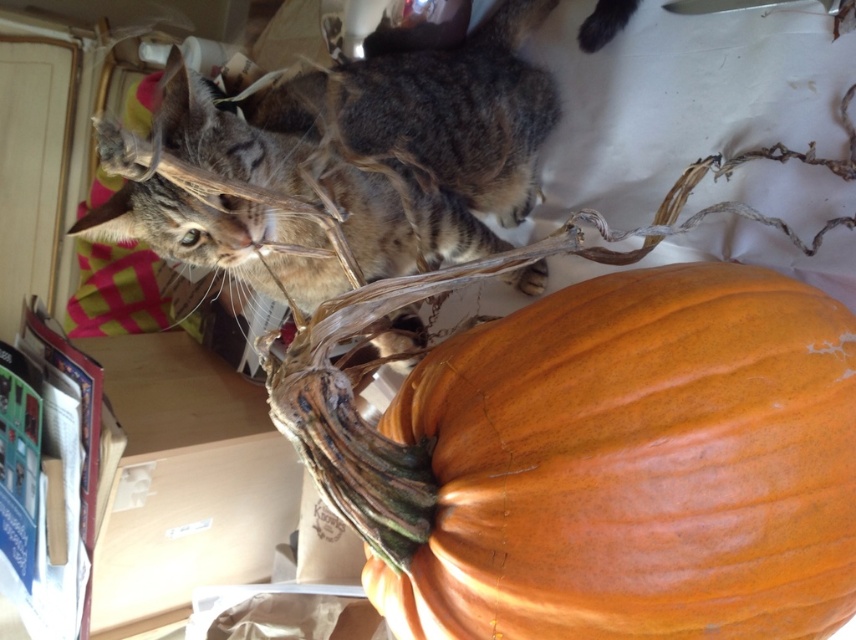
You are a photographer trying to capture the orange matte pumpkin at center. You have a camera with a focal length of 50mm. To achieve optimal focus, you need to know the distance between you and the pumpkin. Can you determine if the distance is sufficient for your camera settings?

The orange matte pumpkin at center is 22.04 inches away from the viewer. Since most cameras with a 50mm focal length have a minimum focusing distance of around 12 inches, 22.04 inches is sufficient for clear focus.

Consider the image. Based on the scene, where is the orange matte pumpkin at center located in terms of coordinates?

The orange matte pumpkin at center is located at point coordinates of [635,465].

You are a photographer trying to capture a closeup of the pumpkin. You notice two points marked in the image. The first point is at coordinate point (527, 433) and the second is at point (110, 579). Which point should you focus on to ensure the pumpkin is in focus?

Point (527, 433) is closer to the camera than point (110, 579), so focusing on point (527, 433) will ensure the pumpkin is in focus.